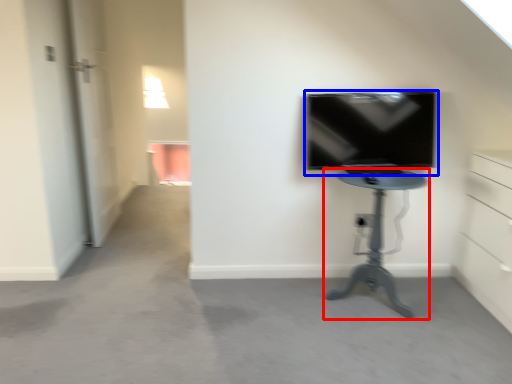
Question: Which of the following is the closest to the observer, furniture (highlighted by a red box) or television (highlighted by a blue box)?

Choices:
 (A) furniture
 (B) television

Answer: (A)